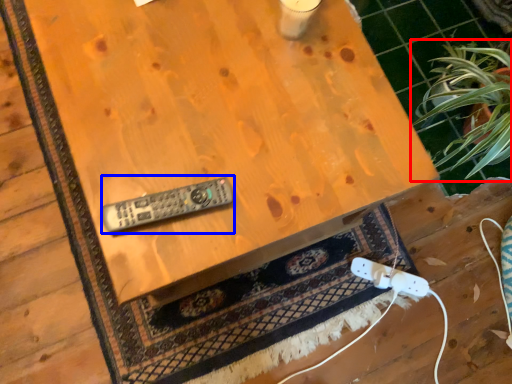
Question: Which of the following is the farthest to the observer, houseplant (highlighted by a red box) or control (highlighted by a blue box)?

Choices:
 (A) houseplant
 (B) control

Answer: (A)